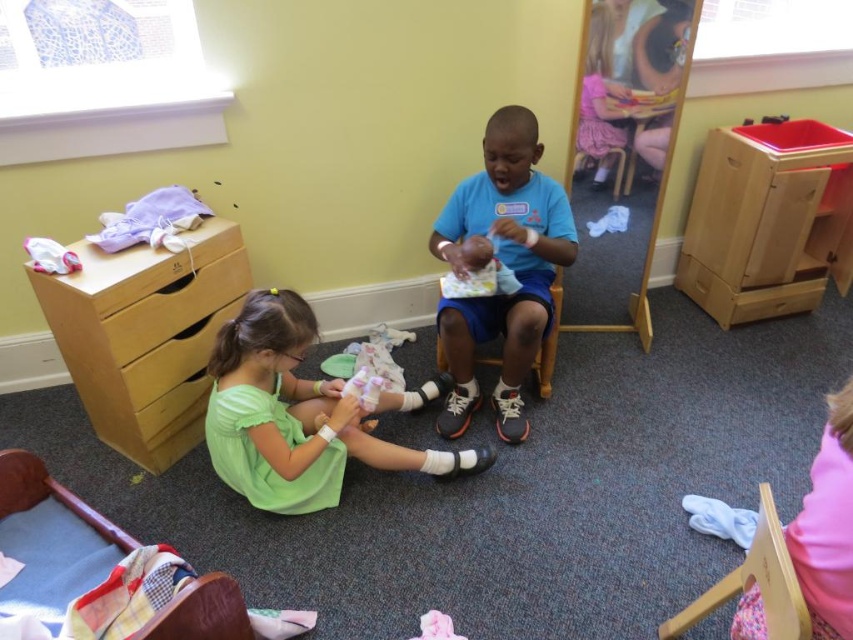
Consider the image. Does wooden drawer at right come in front of green fabric doll at lower center?

No.

Does wooden drawer at right have a lesser width compared to green fabric doll at lower center?

Yes.

Which is in front, point (741, 262) or point (235, 317)?

Positioned in front is point (235, 317).

Image resolution: width=853 pixels, height=640 pixels. I want to click on wooden drawer at right, so click(x=769, y=220).

Who is lower down, wooden drawer at right or blue matte shirt at center?

blue matte shirt at center is below.

Does point (822, 200) lie in front of point (469, 230)?

No, (822, 200) is behind (469, 230).

Locate an element on the screen. This screenshot has width=853, height=640. wooden drawer at right is located at coordinates (769, 220).

Who is lower down, wooden dresser at left or green fabric doll at lower center?

Positioned lower is green fabric doll at lower center.

Which is more to the right, wooden dresser at left or green fabric doll at lower center?

From the viewer's perspective, green fabric doll at lower center appears more on the right side.

Describe the element at coordinates (144, 336) in the screenshot. I see `wooden dresser at left` at that location.

I want to click on wooden dresser at left, so click(x=144, y=336).